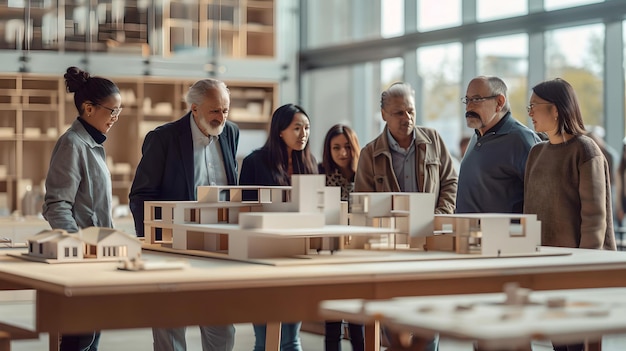
Locate an element on the screen. The width and height of the screenshot is (626, 351). large table is located at coordinates (375, 274).